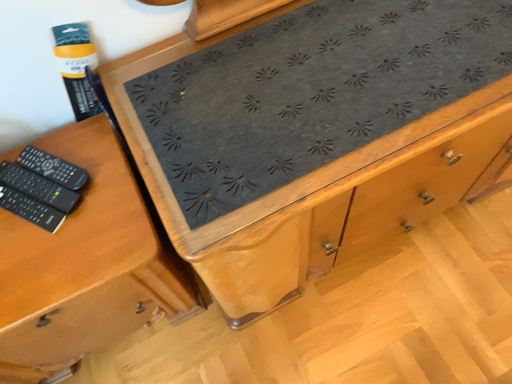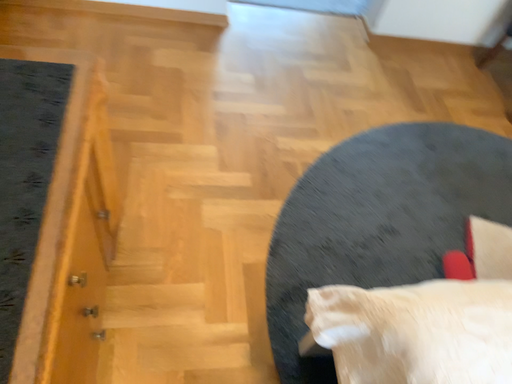
Question: Which way did the camera rotate in the video?

Choices:
 (A) rotated left
 (B) rotated right

Answer: (B)